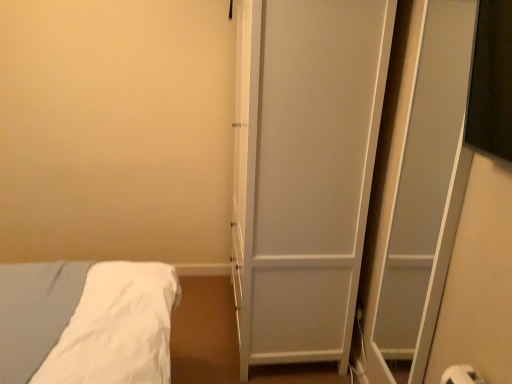
What is the approximate width of white cotton bed at lower left?

white cotton bed at lower left is 24.40 inches in width.

Describe the element at coordinates (87, 322) in the screenshot. I see `white cotton bed at lower left` at that location.

At what (x,y) coordinates should I click in order to perform the action: click on white cotton bed at lower left. Please return your answer as a coordinate pair (x, y). The width and height of the screenshot is (512, 384). Looking at the image, I should click on (87, 322).

In order to face white cotton bed at lower left, should I rotate leftwards or rightwards?

You should look left and rotate roughly 30.186 degrees.

Locate an element on the screen. white cotton bed at lower left is located at coordinates (87, 322).